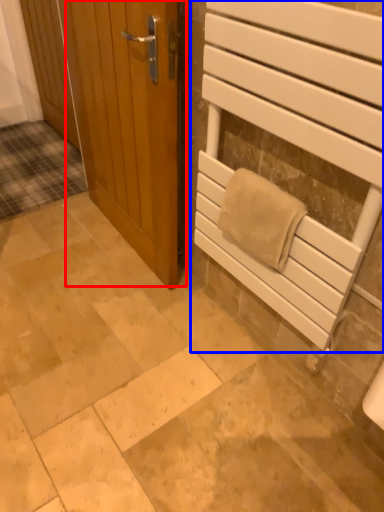
Question: Which object appears closest to the camera in this image, door (highlighted by a red box) or elevator (highlighted by a blue box)?

Choices:
 (A) door
 (B) elevator

Answer: (B)